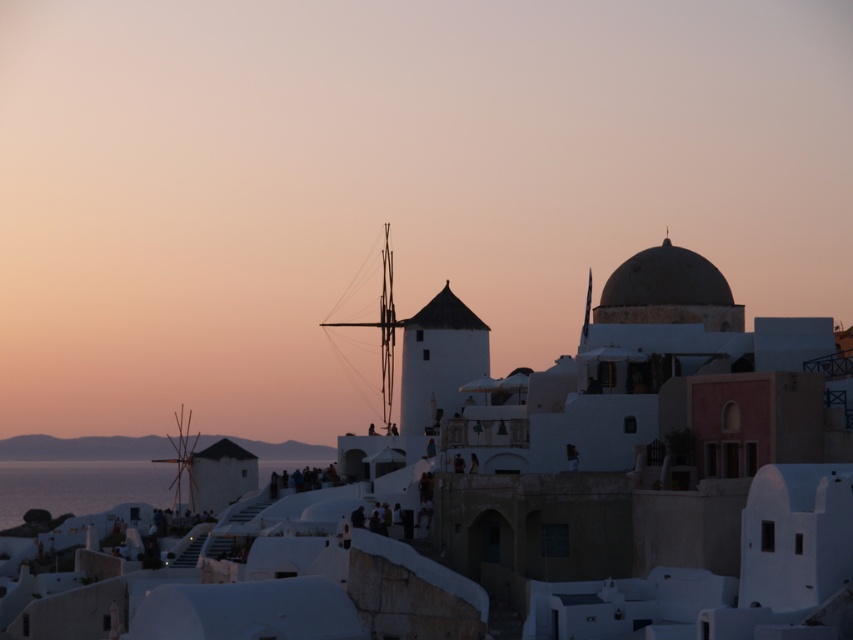
Question: Where is white matte building at center located in relation to white matte windmill at center in the image?

Choices:
 (A) below
 (B) above

Answer: (B)

Question: Does white matte building at center have a smaller size compared to white matte windmill at center?

Choices:
 (A) no
 (B) yes

Answer: (A)

Question: Which point is farther to the camera?

Choices:
 (A) white matte windmill at center
 (B) white matte building at center

Answer: (A)

Question: Is white matte building at center smaller than white matte windmill at center?

Choices:
 (A) yes
 (B) no

Answer: (B)